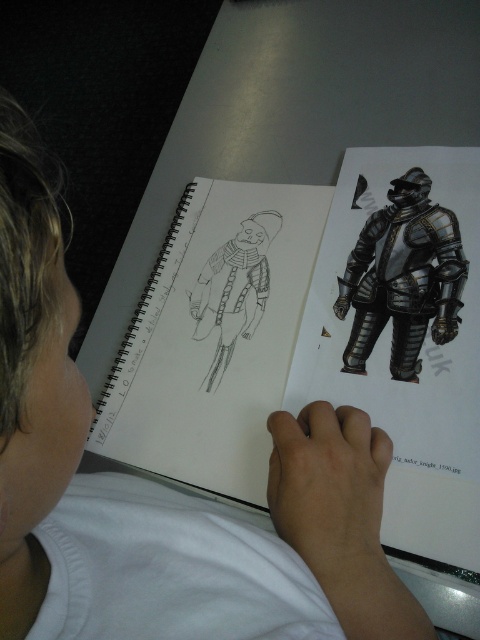
Can you confirm if black paper sketchbook at upper center is positioned to the left of shiny metallic armor at upper right?

Correct, you'll find black paper sketchbook at upper center to the left of shiny metallic armor at upper right.

Image resolution: width=480 pixels, height=640 pixels. What do you see at coordinates (214, 337) in the screenshot?
I see `black paper sketchbook at upper center` at bounding box center [214, 337].

This screenshot has width=480, height=640. I want to click on black paper sketchbook at upper center, so click(214, 337).

Is shiny metallic armor at upper right thinner than graphite sketch at center?

No, shiny metallic armor at upper right is not thinner than graphite sketch at center.

Image resolution: width=480 pixels, height=640 pixels. Describe the element at coordinates (403, 276) in the screenshot. I see `shiny metallic armor at upper right` at that location.

You are a GUI agent. You are given a task and a screenshot of the screen. Output one action in this format:
    pyautogui.click(x=<x>, y=<y>)
    Task: Click on the shiny metallic armor at upper right
    
    Given the screenshot: What is the action you would take?
    pyautogui.click(x=403, y=276)

Is black paper sketchbook at upper center wider than graphite sketch at center?

Yes, black paper sketchbook at upper center is wider than graphite sketch at center.

Is black paper sketchbook at upper center to the left of graphite sketch at center from the viewer's perspective?

Yes, black paper sketchbook at upper center is to the left of graphite sketch at center.

Is point (166, 339) positioned behind point (262, 292)?

Yes, point (166, 339) is behind point (262, 292).

Locate an element on the screen. The height and width of the screenshot is (640, 480). black paper sketchbook at upper center is located at coordinates (214, 337).